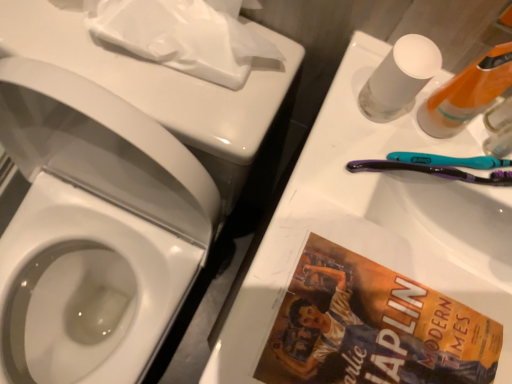
What are the coordinates of `free space on the front side of orange plastic bottle at upper right` in the screenshot? It's located at (374, 273).